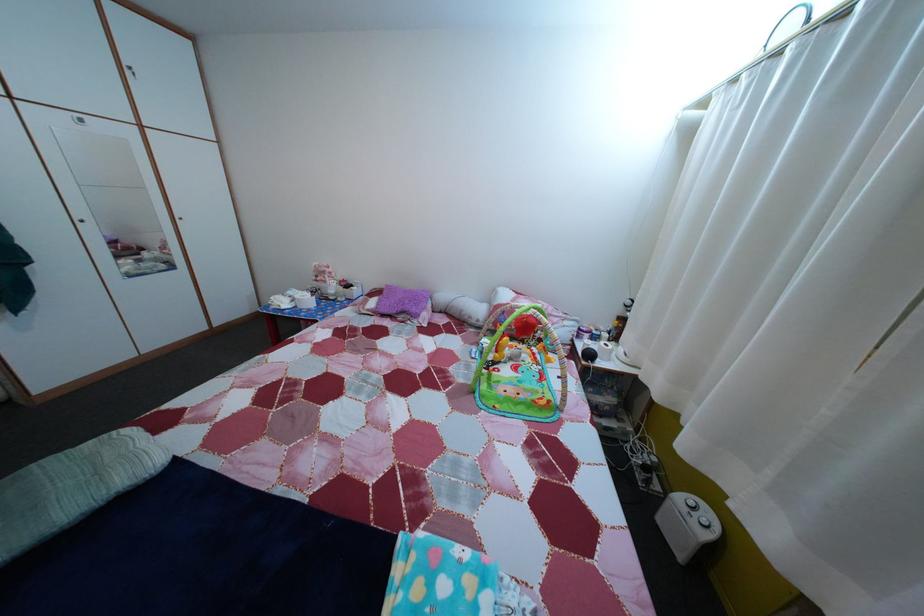
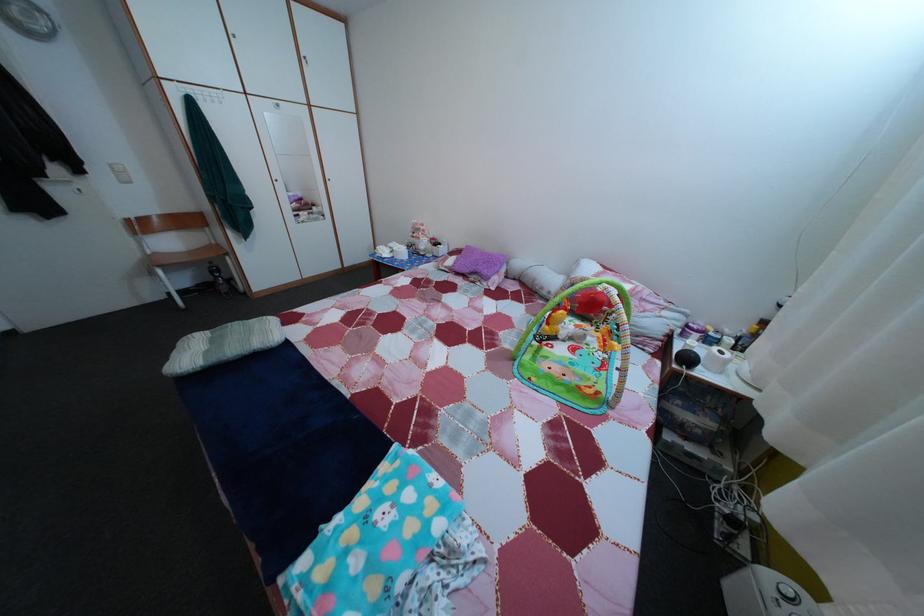
Question: The first image is from the beginning of the video and the second image is from the end. How did the camera likely rotate when shooting the video?

Choices:
 (A) Left
 (B) Right
 (C) Up
 (D) Down

Answer: (A)